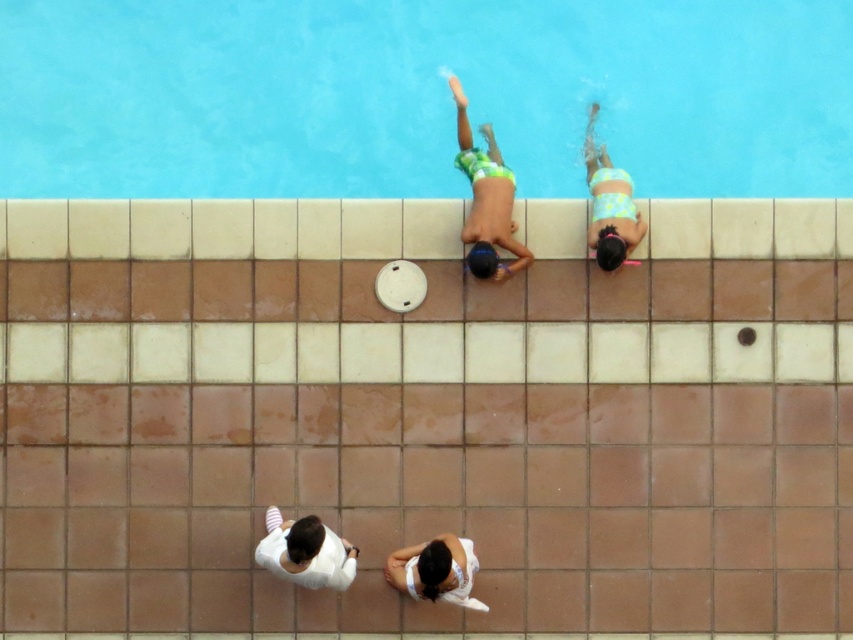
You are standing at the edge of the pool and want to throw a ball to a friend. You see two points marked in the scene. Which point, point (544, 168) or point (421, 593), is closer to you?

Point (544, 168) is closer to you because it is further to the viewer than point (421, 593).